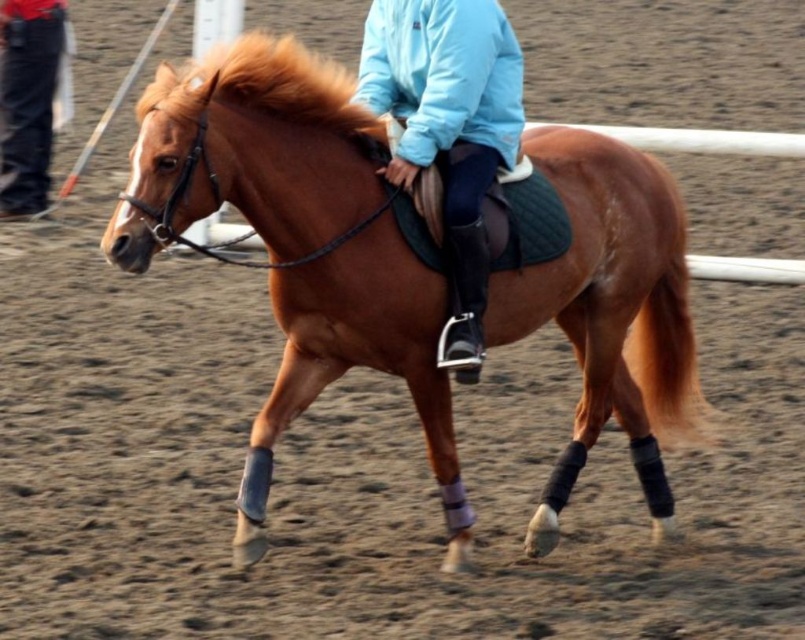
You are a photographer standing in the arena. You notice the brown silky mane at upper center and the black jeans at left. Which object is closer to you?

The brown silky mane at upper center is closer to you because it is in front of the black jeans at left.

You are a photographer standing at the camera position. You want to place a marker at a point that is exactly 20 feet away from you. The arena has a point marked as point (618, 340). Is this point suitable for placing the marker?

The distance of point (618, 340) from camera is 20.46 feet, which is slightly more than 20 feet. Therefore, the point is not suitable for placing the marker as it exceeds the desired distance by 0.46 feet.

You are a photographer positioned at the edge of the arena. You want to take a photo of the brown glossy horse at center and the black jeans at left. If your camera has a maximum focus range of 5 meters, will both subjects be in focus?

A: The brown glossy horse at center and the black jeans at left are 5.75 meters apart from each other. Since the camera can only focus up to 5 meters, the distance between them exceeds the focus range, so both subjects cannot be in focus simultaneously.